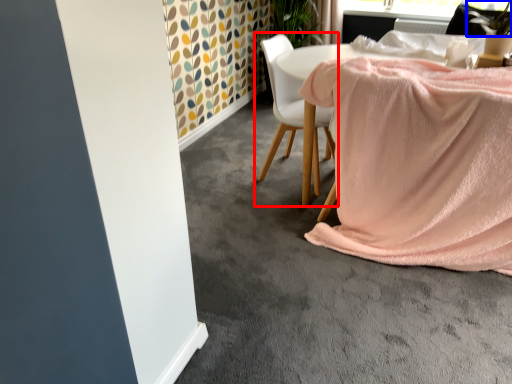
Question: Which object appears closest to the camera in this image, chair (highlighted by a red box) or plant (highlighted by a blue box)?

Choices:
 (A) chair
 (B) plant

Answer: (B)